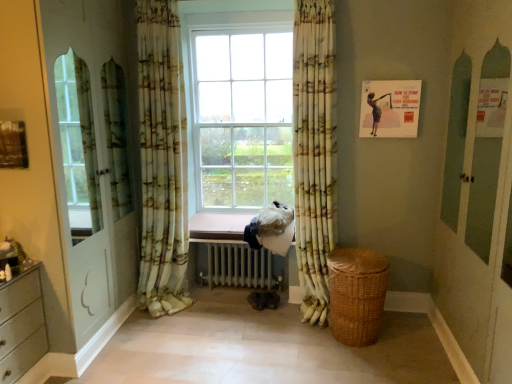
I want to click on free space in front of white metallic radiator at center, so click(242, 326).